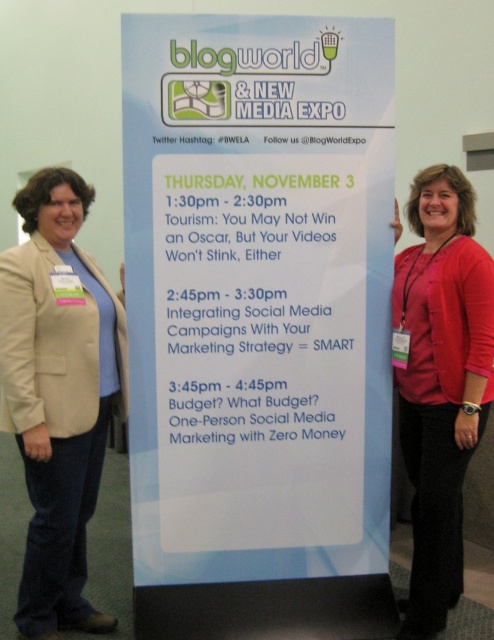
From the picture: Between white paper sign at center and red matte shirt at center, which one appears on the left side from the viewer's perspective?

From the viewer's perspective, white paper sign at center appears more on the left side.

Is point (149, 301) positioned behind point (463, 464)?

That is True.

Is point (284, 419) more distant than point (413, 408)?

That is False.

Where is `white paper sign at center`? white paper sign at center is located at coordinates click(x=257, y=294).

Between white paper sign at center and beige fabric blazer at left, which one is positioned higher?

white paper sign at center

Does point (272, 477) come closer to viewer compared to point (15, 330)?

No, it is not.

Measure the distance between point (316, 428) and camera.

Point (316, 428) and camera are 8.39 feet apart from each other.

Locate an element on the screen. The image size is (494, 640). white paper sign at center is located at coordinates (257, 294).

Does beige fabric blazer at left have a greater height compared to red matte shirt at center?

Incorrect, beige fabric blazer at left's height is not larger of red matte shirt at center's.

Which is above, beige fabric blazer at left or red matte shirt at center?

Positioned higher is red matte shirt at center.

What do you see at coordinates (58, 394) in the screenshot? This screenshot has height=640, width=494. I see `beige fabric blazer at left` at bounding box center [58, 394].

At what (x,y) coordinates should I click in order to perform the action: click on beige fabric blazer at left. Please return your answer as a coordinate pair (x, y). Looking at the image, I should click on (58, 394).